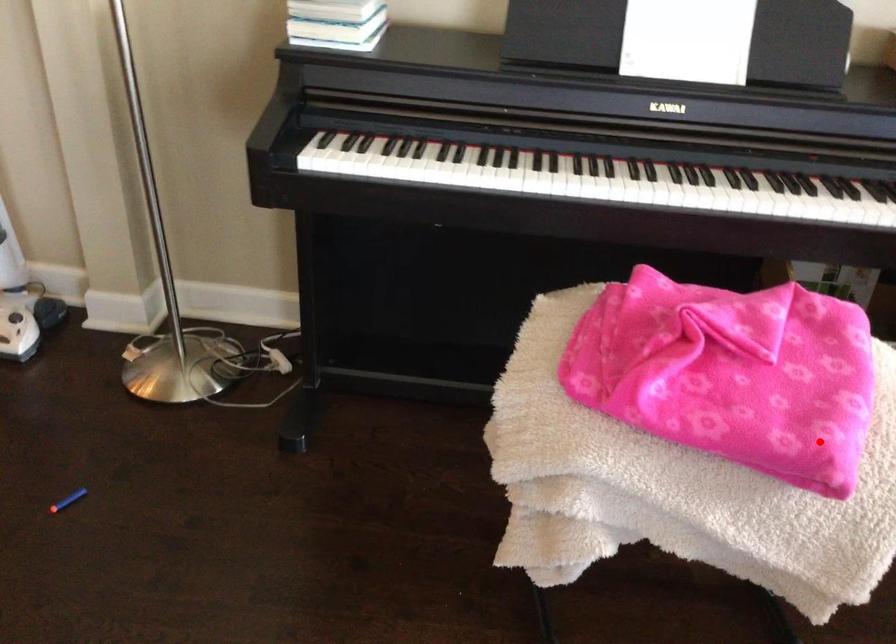
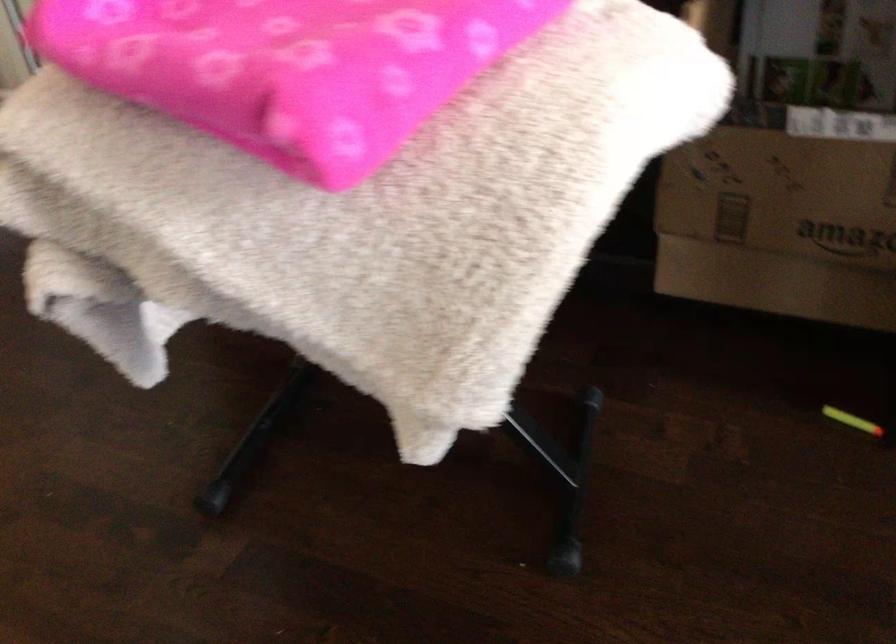
Locate, in the second image, the point that corresponds to the highlighted location in the first image.

(288, 67)